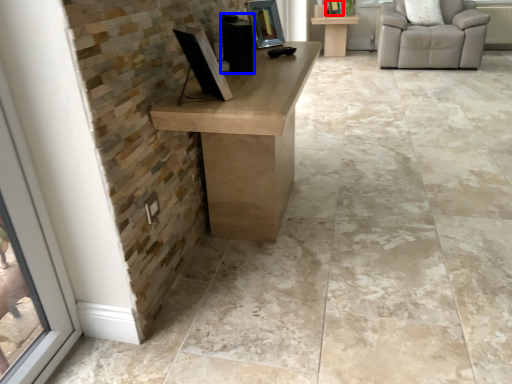
Question: Among these objects, which one is farthest to the camera, picture frame (highlighted by a red box) or speaker (highlighted by a blue box)?

Choices:
 (A) picture frame
 (B) speaker

Answer: (A)